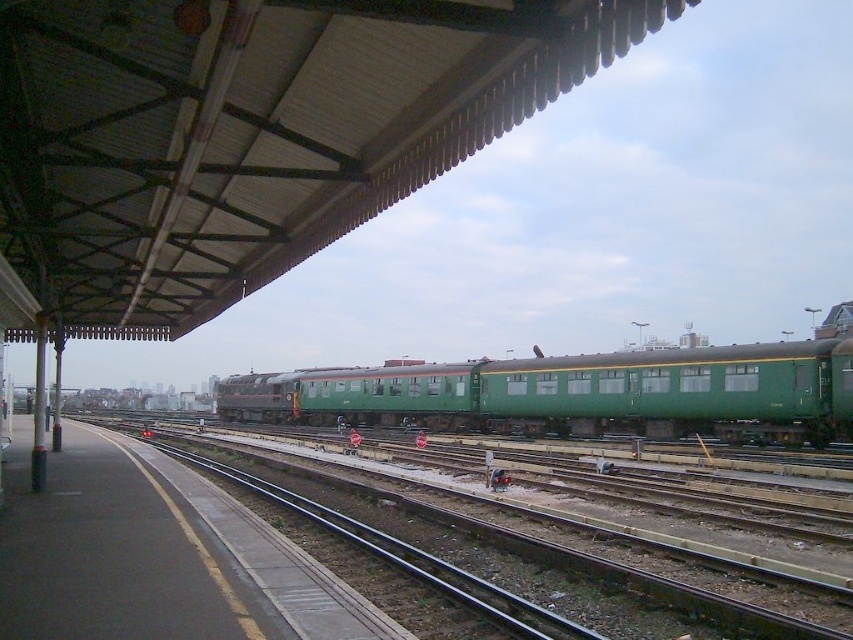
You are a railway worker checking the platform safety. You need to ensure the green matte train car at center can fit within the green metal track at center. Based on their sizes, is there a risk of the train car exceeding the track width?

The green matte train car at center is wider than the green metal track at center, so there is a risk of the train car exceeding the track width.

You are standing at the railway station platform and want to walk from point A to point B. Point A is located at coordinate point (288, 412) and point B is at coordinate point (555, 547). Considering the platform layout described, which direction should you face to walk towards point B from point A?

Since point A is further to the camera than point B, you should face towards the lower right direction to walk from point A to point B.